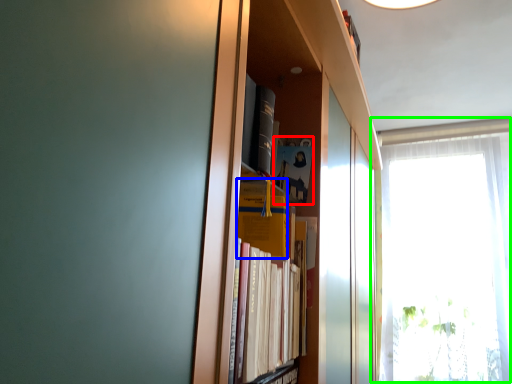
Question: Based on their relative distances, which object is nearer to paperback book (highlighted by a red box)? Choose from paperback book (highlighted by a blue box) and window (highlighted by a green box).

Choices:
 (A) paperback book
 (B) window

Answer: (A)